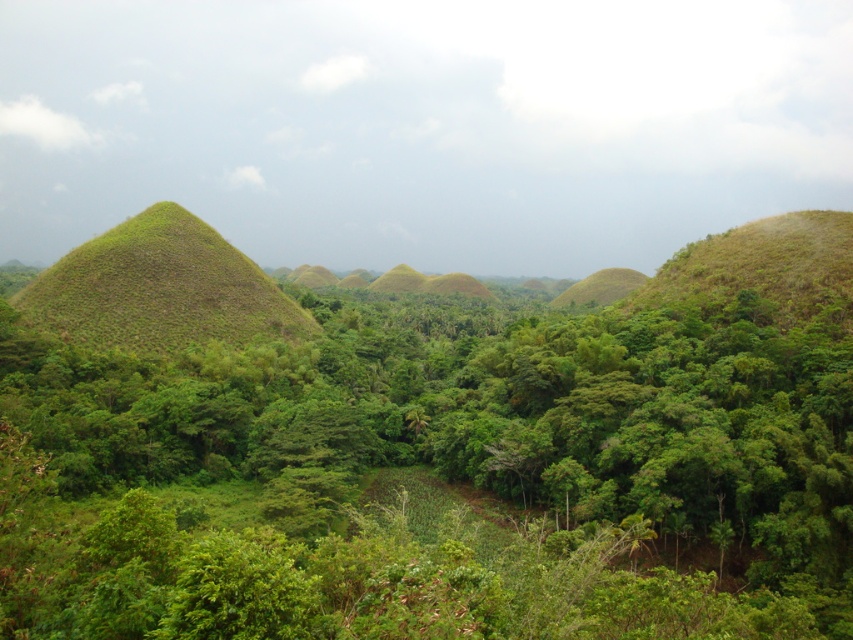
You are standing at the base of the green grassy hill at left and want to walk to the green leafy tree at center. Which direction should you head towards?

To reach the green leafy tree at center from the green grassy hill at left, you should head towards the right, as the green leafy tree at center is located to the right of the green grassy hill at left.

You are a hiker standing at the base of the green grassy hill at left and want to reach the green leafy tree at center. Which direction should you walk to avoid the hill?

To reach the green leafy tree at center from the green grassy hill at left, you should walk away from the hill since the tree is positioned under the hill, meaning it is located behind or below the hill from your current position.